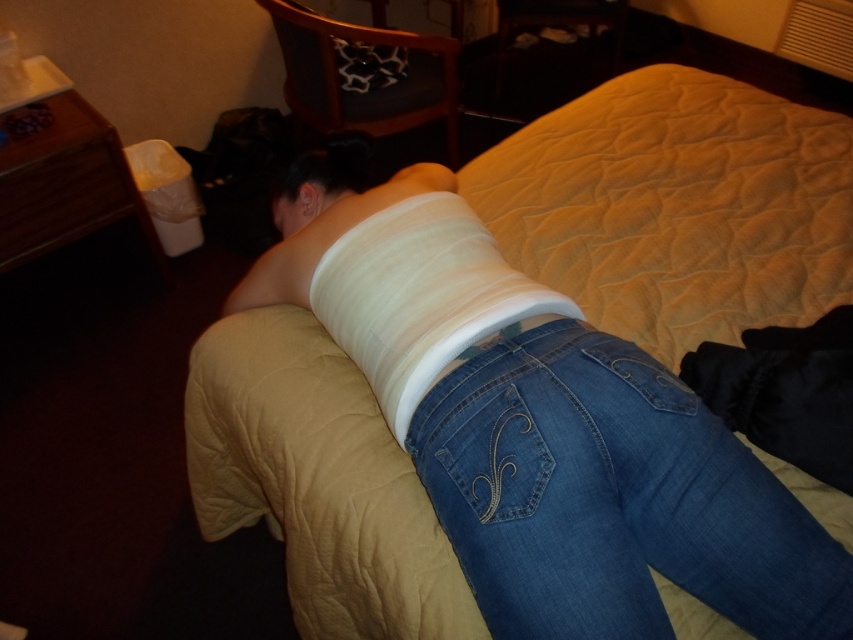
Question: Is denim at center to the right of white fabric bandage at center from the viewer's perspective?

Choices:
 (A) no
 (B) yes

Answer: (B)

Question: Which point is farther from the camera taking this photo?

Choices:
 (A) (672, 200)
 (B) (392, 358)
 (C) (624, 406)

Answer: (A)

Question: Which of the following is the closest to the observer?

Choices:
 (A) white fabric bandage at center
 (B) beige quilted bed at center
 (C) denim at center

Answer: (C)

Question: Which of the following is the closest to the observer?

Choices:
 (A) denim at center
 (B) white fabric bandage at center

Answer: (A)

Question: Does beige quilted bed at center appear over denim at center?

Choices:
 (A) yes
 (B) no

Answer: (A)

Question: Is beige quilted bed at center wider than denim at center?

Choices:
 (A) yes
 (B) no

Answer: (A)